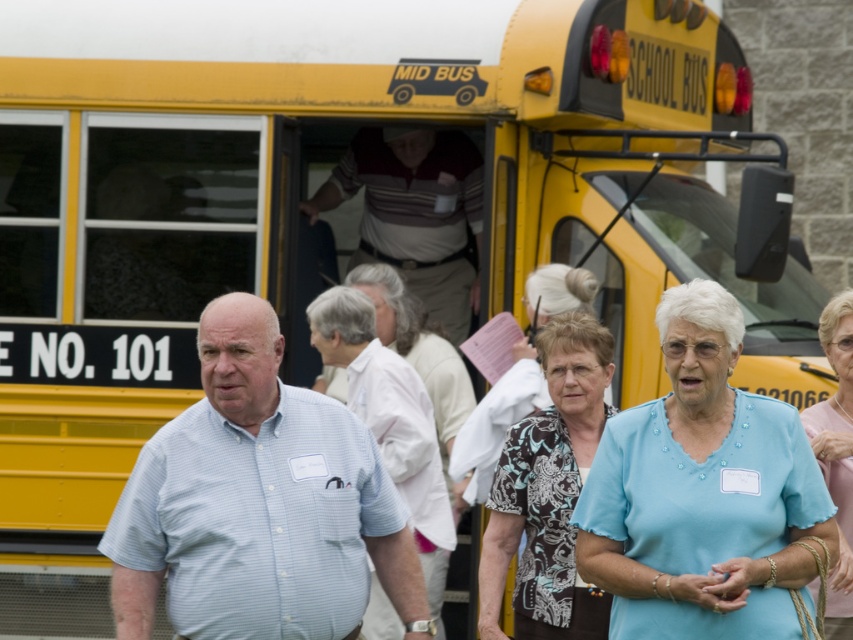
Is light blue fabric at center shorter than light blue shirt at center?

Yes, light blue fabric at center is shorter than light blue shirt at center.

Can you confirm if light blue fabric at center is positioned above light blue shirt at center?

Correct, light blue fabric at center is located above light blue shirt at center.

Is point (708, 358) less distant than point (375, 573)?

Yes.

Image resolution: width=853 pixels, height=640 pixels. I want to click on light blue fabric at center, so click(x=704, y=493).

Does striped polo shirt at center appear over light blue shirt at center?

Yes.

Which is behind, point (444, 307) or point (379, 413)?

Point (444, 307)

Describe the element at coordinates (415, 212) in the screenshot. Image resolution: width=853 pixels, height=640 pixels. I see `striped polo shirt at center` at that location.

Where is `striped polo shirt at center`? The width and height of the screenshot is (853, 640). striped polo shirt at center is located at coordinates (415, 212).

Between light blue striped shirt at center and striped polo shirt at center, which one is positioned lower?

light blue striped shirt at center

Who is positioned more to the left, light blue striped shirt at center or striped polo shirt at center?

light blue striped shirt at center

This screenshot has height=640, width=853. Find the location of `light blue striped shirt at center`. light blue striped shirt at center is located at coordinates (258, 504).

Where is `light blue striped shirt at center`? The image size is (853, 640). light blue striped shirt at center is located at coordinates (258, 504).